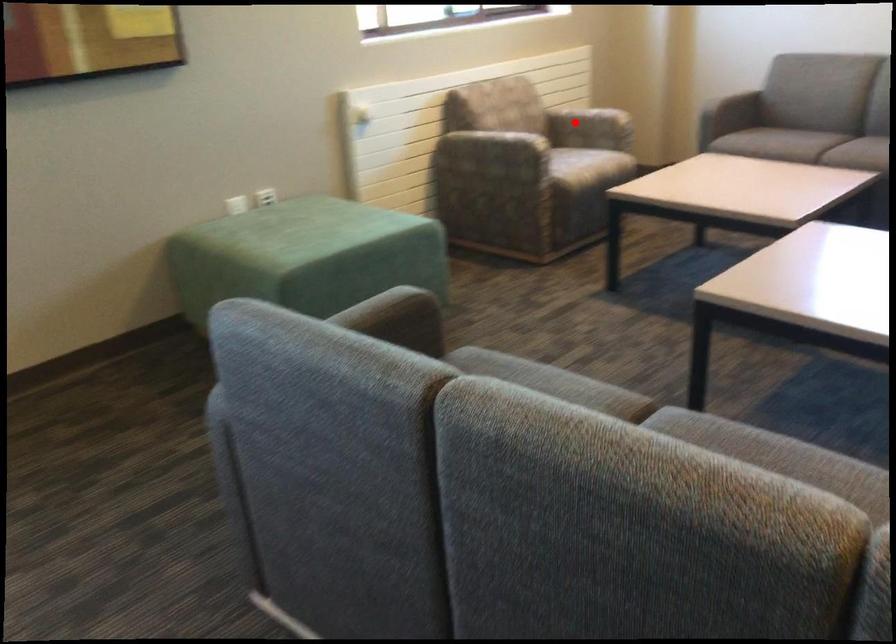
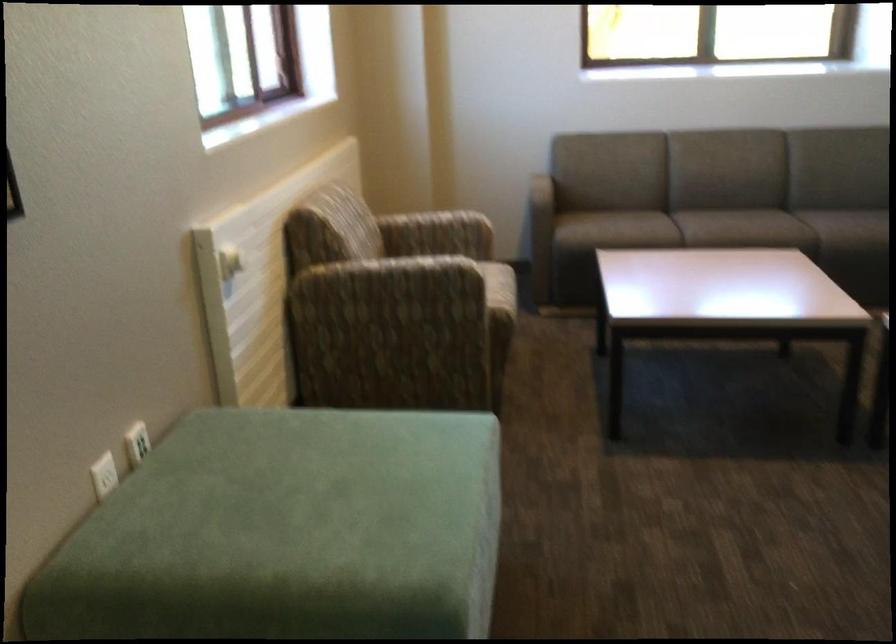
The point at the highlighted location is marked in the first image. Where is the corresponding point in the second image?

(436, 234)